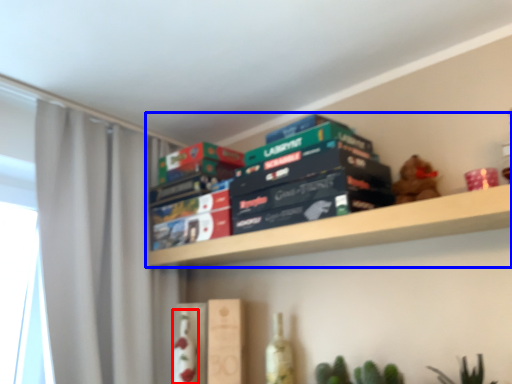
Question: Which object appears farthest to the camera in this image, bottle (highlighted by a red box) or shelf (highlighted by a blue box)?

Choices:
 (A) bottle
 (B) shelf

Answer: (A)